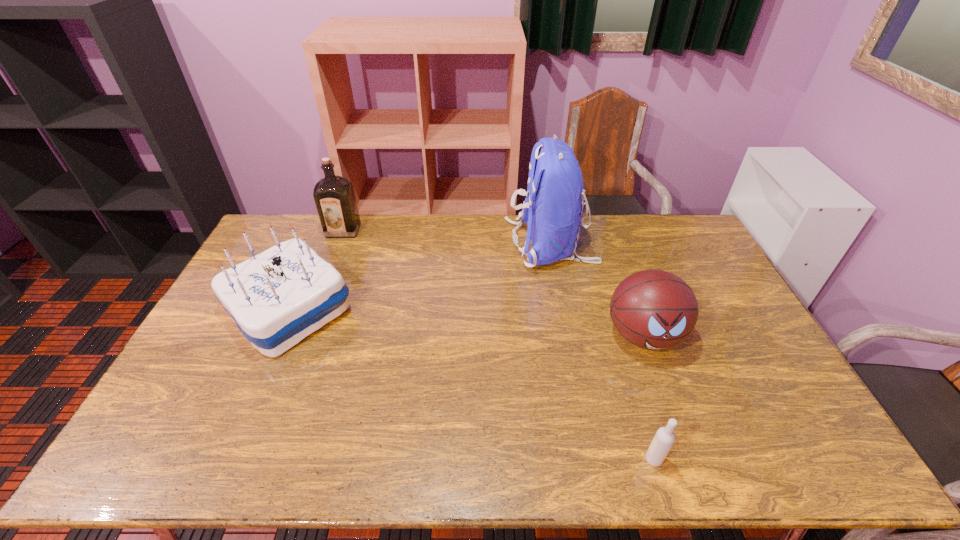
Image resolution: width=960 pixels, height=540 pixels. Identify the location of the tallest object. (553, 208).

At what (x,y) coordinates should I click in order to perform the action: click on liquor. Please return your answer as a coordinate pair (x, y). Looking at the image, I should click on (334, 196).

This screenshot has height=540, width=960. What are the coordinates of `birthday cake` in the screenshot? It's located at (x=277, y=298).

Find the location of a particular element. The image size is (960, 540). basketball is located at coordinates (654, 309).

What are the coordinates of `the shortest object` in the screenshot? It's located at (664, 438).

Where is `vodka`? This screenshot has width=960, height=540. vodka is located at coordinates (664, 438).

Find the location of `vacant space located 0.400m on the back of the tallest object`. vacant space located 0.400m on the back of the tallest object is located at coordinates (399, 244).

Where is `vacant position located 0.190m on the back of the tallest object`? This screenshot has width=960, height=540. vacant position located 0.190m on the back of the tallest object is located at coordinates (455, 244).

At what (x,y) coordinates should I click in order to perform the action: click on free space located 0.240m on the back of the tallest object. Please return your answer as a coordinate pair (x, y). Looking at the image, I should click on (442, 244).

Where is `vacant space situated on the label of the liquor`? This screenshot has height=540, width=960. vacant space situated on the label of the liquor is located at coordinates (317, 298).